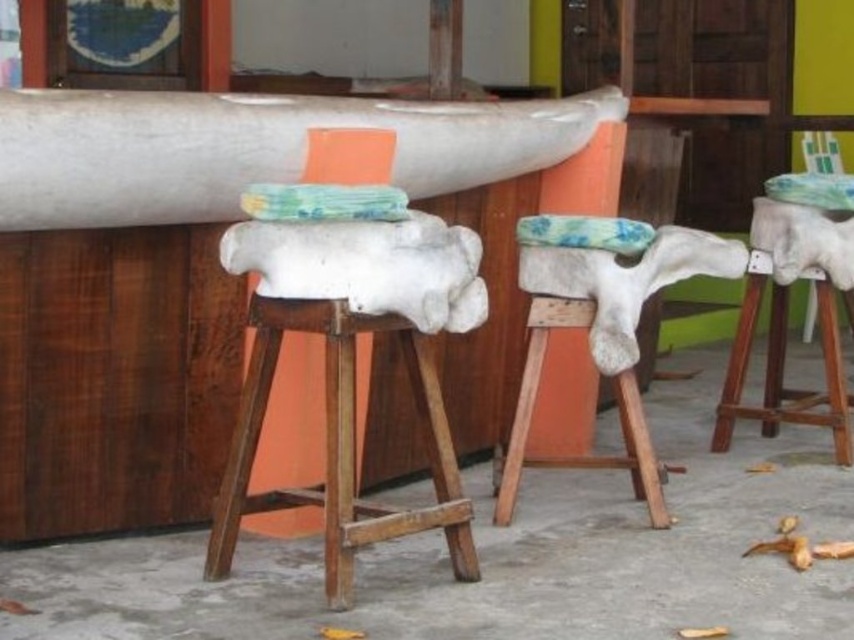
You are a customer looking to sit on one of the stools at the counter. You prefer a stool that is taller for better visibility. Based on the image, which stool should you choose between the white stone stool at center and the white leather stool at center?

The white leather stool at center is taller than the white stone stool at center, so you should choose the white leather stool at center for better visibility.

You are standing in front of the row of stools against the wooden counter. There is a point located at coordinates [348,371]. Which object is this point on?

The point at [348,371] is on the white stone stool at center.

You are standing in a room and see the white matte boat at center and the white stone stool at center. Which object is positioned to the right side?

The white matte boat at center is positioned to the right of the white stone stool at center.